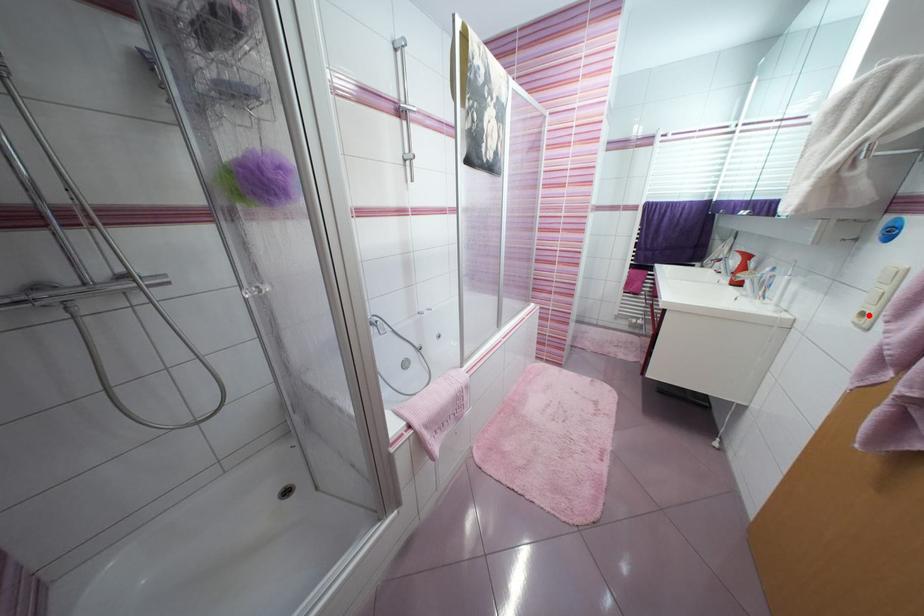
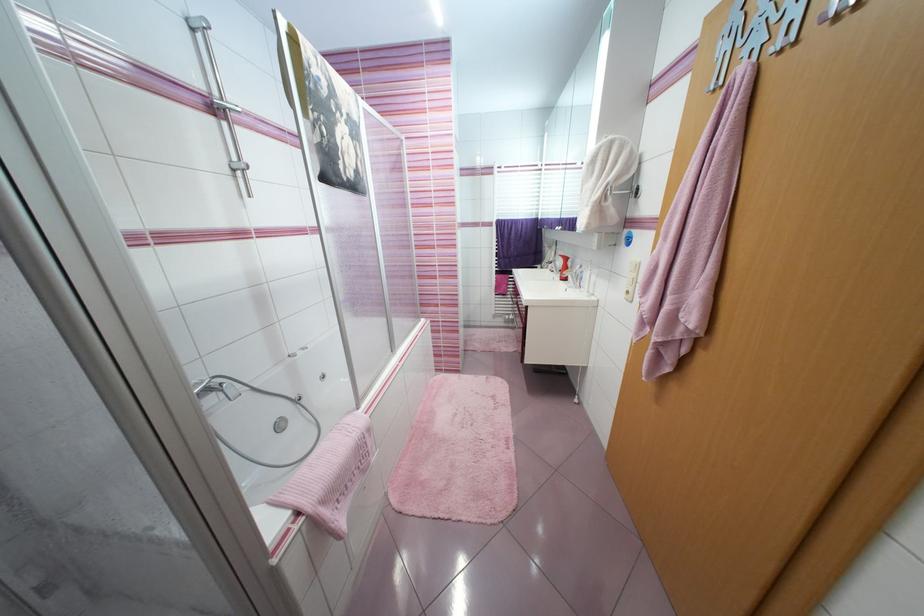
Question: I am providing you with two images of the same scene from different viewpoints. Given a red point in image1, look at the same physical point in image2. Is it:

Choices:
 (A) Closer to the viewpoint
 (B) Farther from the viewpoint

Answer: (A)